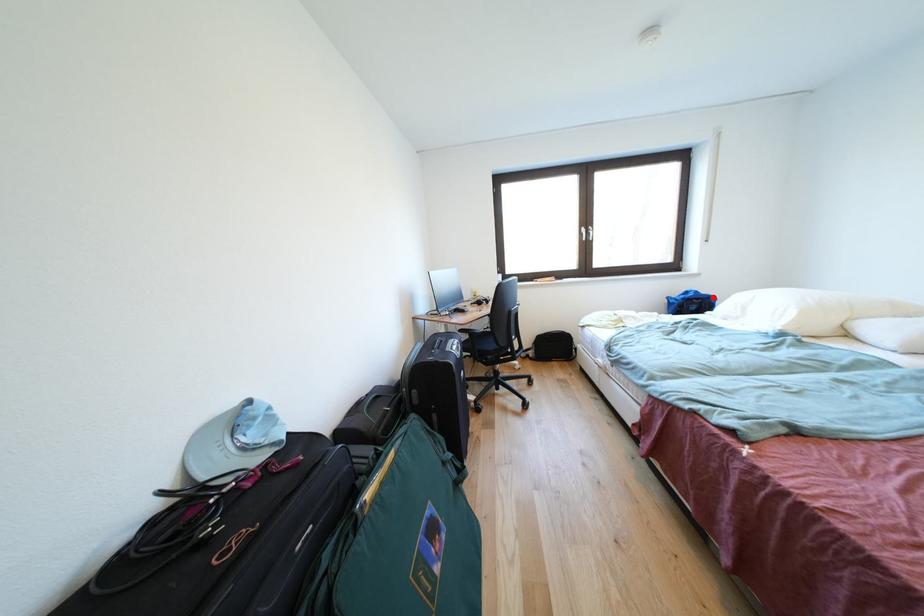
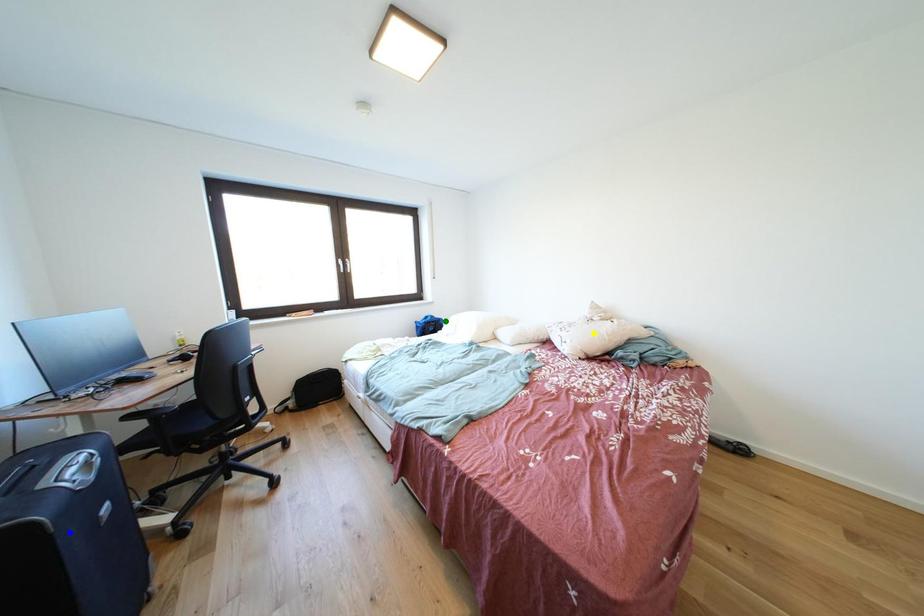
Question: I am providing you with two images of the same scene from different viewpoints. A red point is marked on the first image. You are given multiple points on the second image. In image 2, which mark is for the same physical point as the one in image 1?

Choices:
 (A) blue point
 (B) yellow point
 (C) green point

Answer: (C)